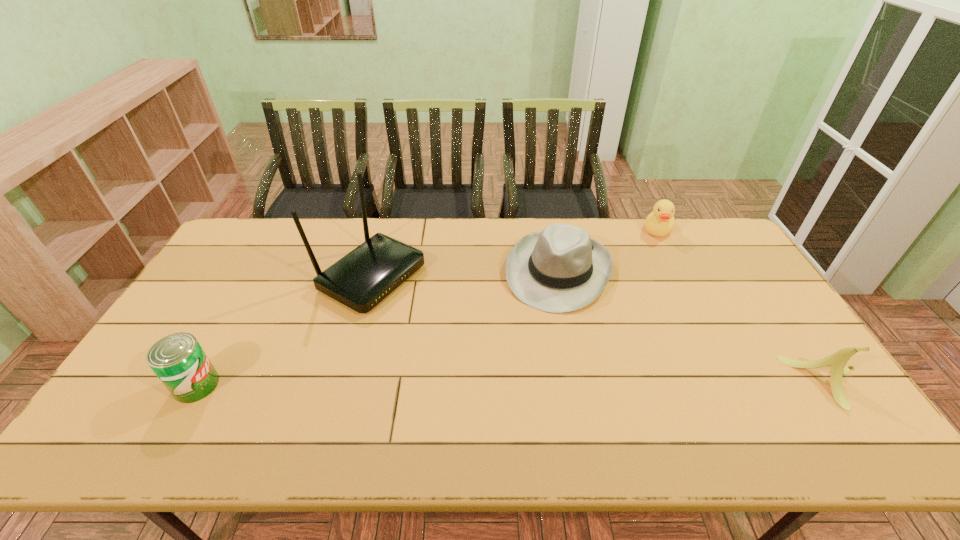
In the image, there is a desktop. Find the location of `vacant space at the near right corner`. vacant space at the near right corner is located at coordinates pyautogui.click(x=786, y=398).

Where is `vacant space in between the banana and the leftmost object`? The image size is (960, 540). vacant space in between the banana and the leftmost object is located at coordinates (512, 383).

Find the location of a particular element. The height and width of the screenshot is (540, 960). free area in between the fourth object from left to right and the fedora is located at coordinates (609, 251).

The image size is (960, 540). Identify the location of vacant area that lies between the tallest object and the fedora. (465, 274).

The width and height of the screenshot is (960, 540). I want to click on free spot between the duck and the leftmost object, so click(427, 307).

This screenshot has height=540, width=960. What are the coordinates of `unoccupied area between the duck and the fedora` in the screenshot? It's located at (609, 251).

The width and height of the screenshot is (960, 540). I want to click on free space that is in between the third object from right to left and the can, so click(x=377, y=328).

You are a GUI agent. You are given a task and a screenshot of the screen. Output one action in this format:
    pyautogui.click(x=<x>, y=<y>)
    Task: Click on the free area in between the third object from left to right and the second object from right to left
    The image size is (960, 540).
    Given the screenshot: What is the action you would take?
    pyautogui.click(x=609, y=251)

Identify the location of free space between the tallest object and the fedora. (465, 274).

You are a GUI agent. You are given a task and a screenshot of the screen. Output one action in this format:
    pyautogui.click(x=<x>, y=<y>)
    Task: Click on the free space between the duck and the can
    This screenshot has width=960, height=540.
    Given the screenshot: What is the action you would take?
    pyautogui.click(x=427, y=307)